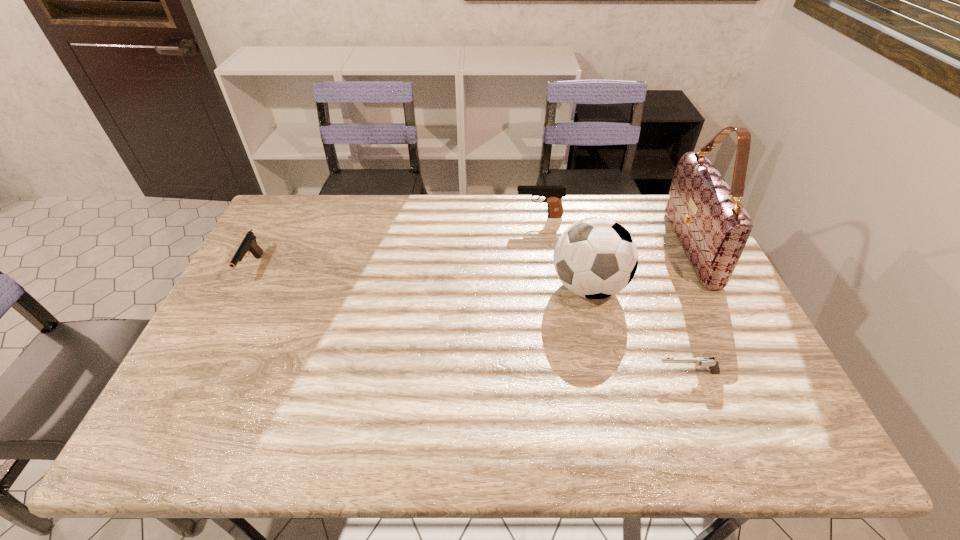
Identify the location of vacant space located on the front of the handbag with the clasp. This screenshot has width=960, height=540. (632, 247).

Find the location of a particular element. The image size is (960, 540). vacant space located on the front of the handbag with the clasp is located at coordinates (572, 247).

Locate an element on the screen. This screenshot has width=960, height=540. free spot located 0.330m on the main logo of the fourth shortest object is located at coordinates (x=438, y=286).

What are the coordinates of `vacant position located 0.240m on the main logo of the fourth shortest object` in the screenshot? It's located at (468, 286).

Image resolution: width=960 pixels, height=540 pixels. I want to click on free space located on the main logo of the fourth shortest object, so click(529, 286).

Locate an element on the screen. blank area located 0.390m at the barrel of the third shortest object is located at coordinates (403, 217).

Where is `vacant space located 0.090m at the barrel of the third shortest object`? Image resolution: width=960 pixels, height=540 pixels. vacant space located 0.090m at the barrel of the third shortest object is located at coordinates (490, 217).

Locate an element on the screen. Image resolution: width=960 pixels, height=540 pixels. free space located at the barrel of the third shortest object is located at coordinates (495, 217).

This screenshot has height=540, width=960. In order to click on vacant space located at the muzzle of the leftmost pistol in this screenshot , I will do `click(224, 324)`.

At what (x,y) coordinates should I click in order to perform the action: click on vacant space located 0.100m on the front-facing side of the nearest pistol. Please return your answer as a coordinate pair (x, y). Looking at the image, I should click on (615, 373).